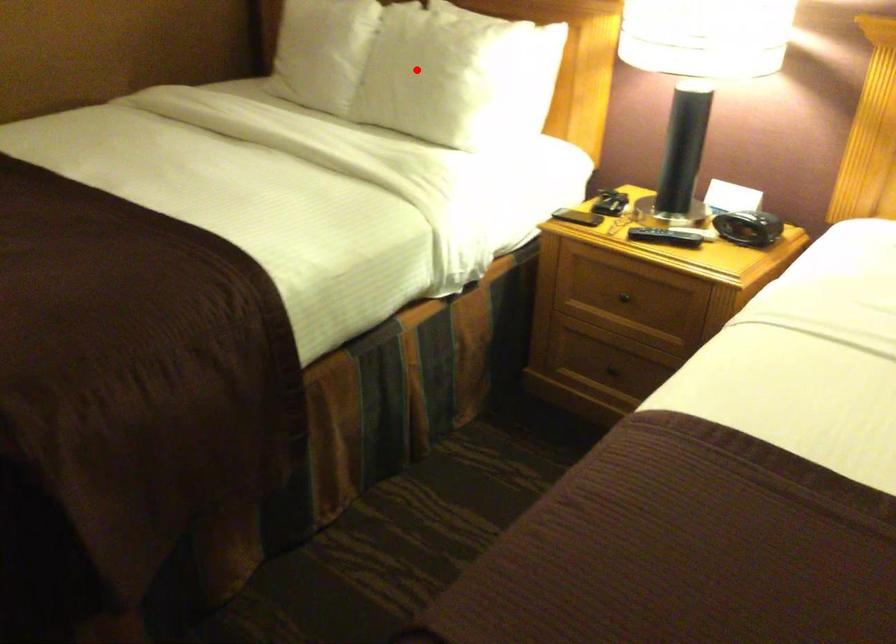
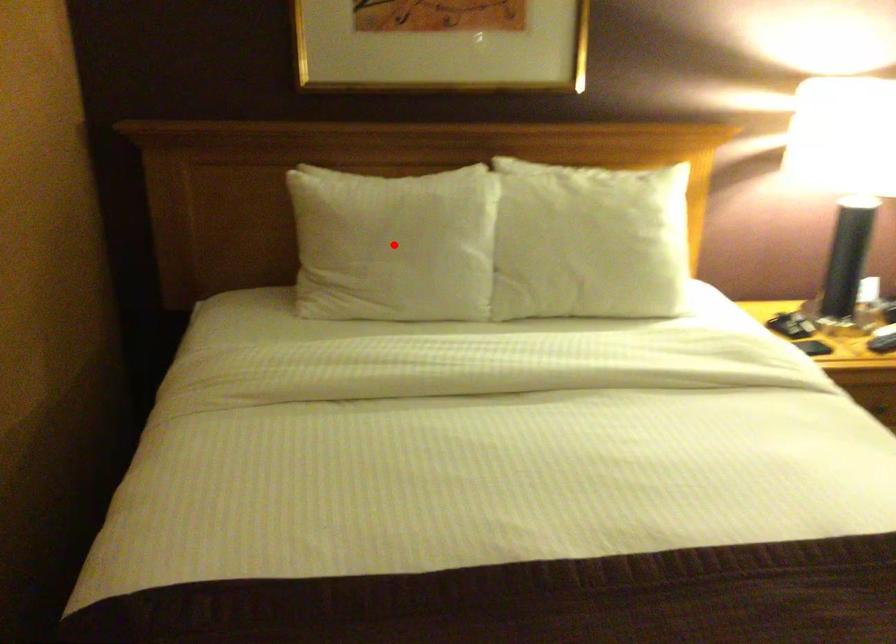
I am providing you with two images of the same scene from different viewpoints. A red point is marked on the first image and another point is marked on the second image. Are the points marked in image1 and image2 representing the same 3D position?

No